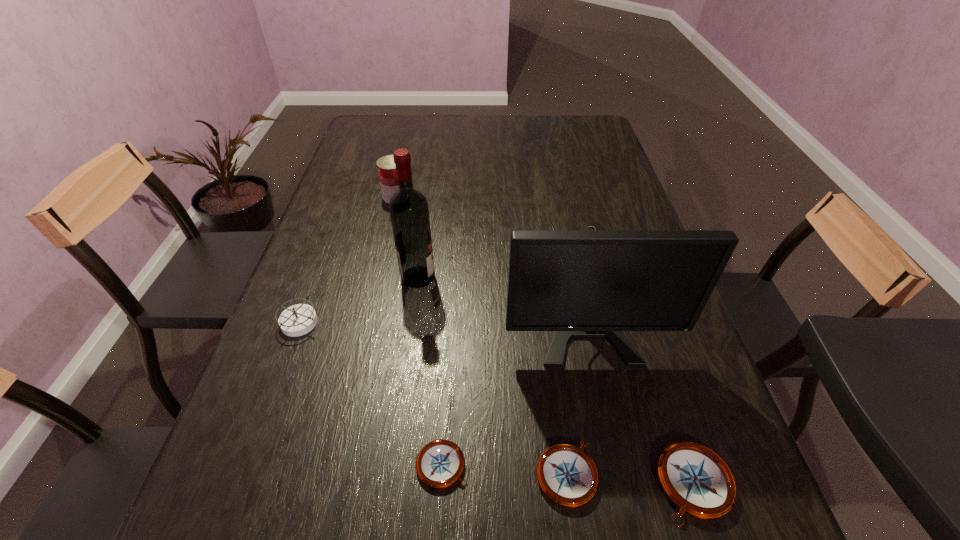
Please point out where to position a new compass on the left to maintain spacing. Please provide its 2D coordinates. Your answer should be formatted as a tuple, i.e. [(x, y)], where the tuple contains the x and y coordinates of a point satisfying the conditions above.

[(321, 456)]